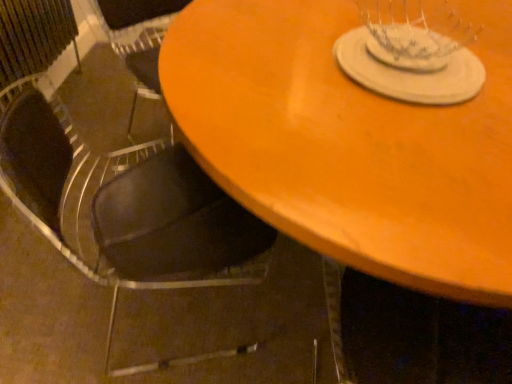
Question: Considering the relative sizes of black leather chair at lower left and wooden table at center in the image provided, is black leather chair at lower left taller than wooden table at center?

Choices:
 (A) yes
 (B) no

Answer: (A)

Question: Is black leather chair at lower left further to camera compared to wooden table at center?

Choices:
 (A) no
 (B) yes

Answer: (B)

Question: Does black leather chair at lower left have a smaller size compared to wooden table at center?

Choices:
 (A) yes
 (B) no

Answer: (A)

Question: From a real-world perspective, is black leather chair at lower left physically above wooden table at center?

Choices:
 (A) yes
 (B) no

Answer: (A)

Question: Considering the relative positions of black leather chair at lower left and wooden table at center in the image provided, is black leather chair at lower left to the right of wooden table at center from the viewer's perspective?

Choices:
 (A) yes
 (B) no

Answer: (B)

Question: From the image's perspective, is white matte glass plate at upper center above or below black leather chair at lower left?

Choices:
 (A) below
 (B) above

Answer: (B)

Question: Considering their positions, is white matte glass plate at upper center located in front of or behind black leather chair at lower left?

Choices:
 (A) behind
 (B) front

Answer: (A)

Question: Looking at their shapes, would you say white matte glass plate at upper center is wider or thinner than black leather chair at lower left?

Choices:
 (A) thin
 (B) wide

Answer: (A)

Question: Considering the positions of white matte glass plate at upper center and black leather chair at lower left in the image, is white matte glass plate at upper center bigger or smaller than black leather chair at lower left?

Choices:
 (A) big
 (B) small

Answer: (B)

Question: Is white matte glass plate at upper center taller or shorter than wooden table at center?

Choices:
 (A) short
 (B) tall

Answer: (A)

Question: Based on their sizes in the image, would you say white matte glass plate at upper center is bigger or smaller than wooden table at center?

Choices:
 (A) small
 (B) big

Answer: (A)

Question: From a real-world perspective, relative to wooden table at center, is white matte glass plate at upper center vertically above or below?

Choices:
 (A) below
 (B) above

Answer: (B)

Question: Is point (355, 71) closer or farther from the camera than point (414, 284)?

Choices:
 (A) closer
 (B) farther

Answer: (B)

Question: Would you say wooden table at center is inside or outside white matte glass plate at upper center?

Choices:
 (A) inside
 (B) outside

Answer: (B)

Question: Does point (321, 74) appear closer or farther from the camera than point (351, 31)?

Choices:
 (A) closer
 (B) farther

Answer: (A)